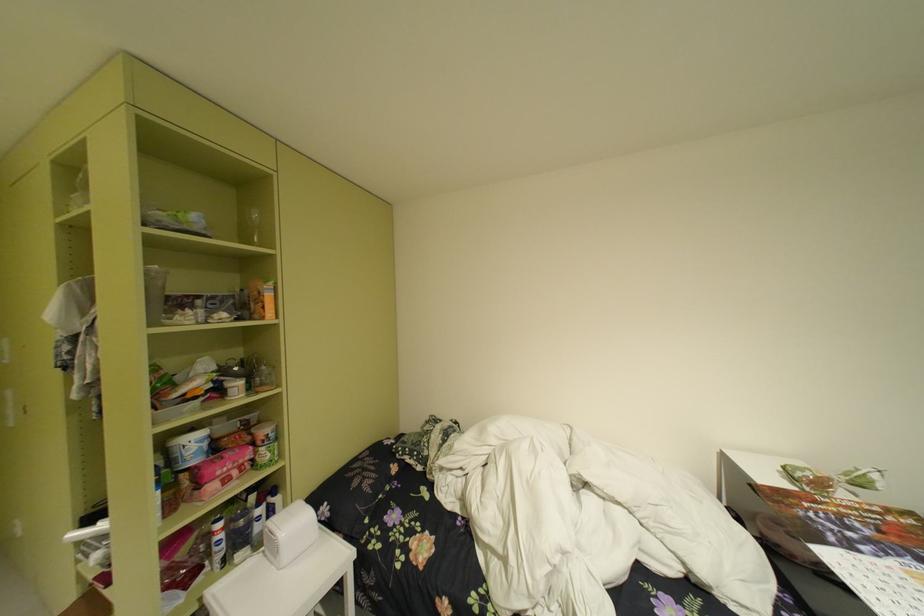
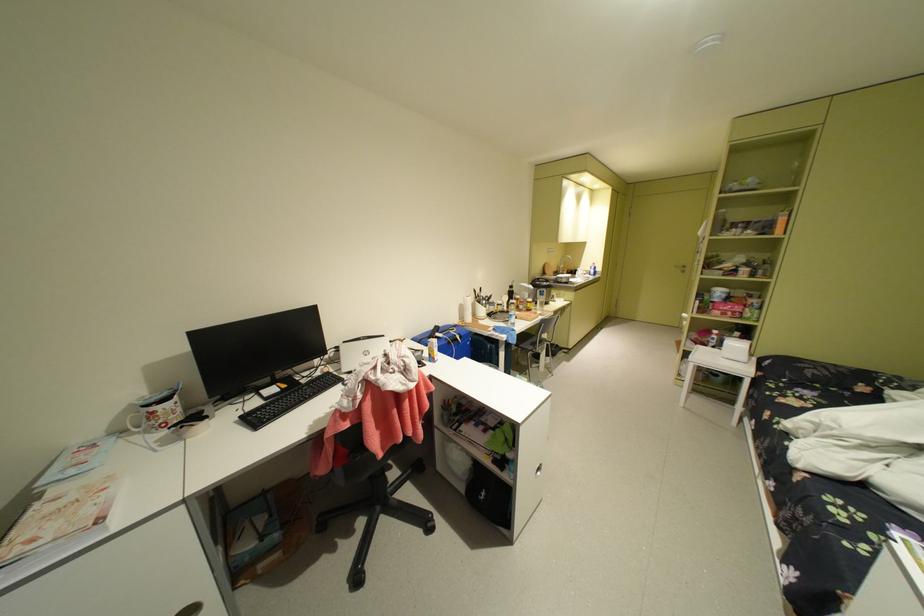
In the second image, find the point that corresponds to (238,455) in the first image.

(740, 304)